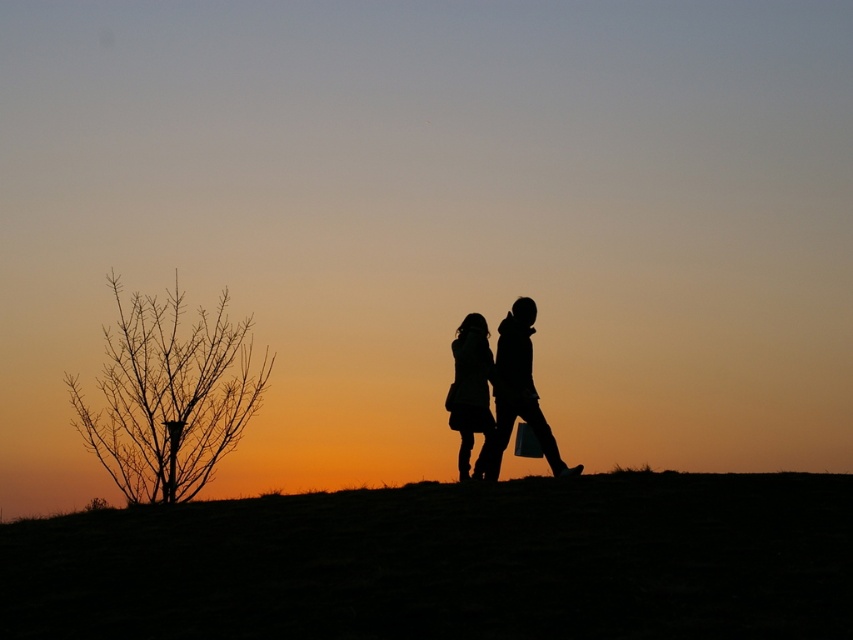
Can you confirm if dark grass at center is positioned to the right of silhouette clothing at center?

In fact, dark grass at center is to the left of silhouette clothing at center.

The height and width of the screenshot is (640, 853). Describe the element at coordinates (450, 563) in the screenshot. I see `dark grass at center` at that location.

Is point (708, 497) positioned behind point (485, 470)?

No.

At what (x,y) coordinates should I click in order to perform the action: click on dark grass at center. Please return your answer as a coordinate pair (x, y). Looking at the image, I should click on (450, 563).

Between point (821, 600) and point (473, 426), which one is positioned behind?

The point (473, 426) is more distant.

The width and height of the screenshot is (853, 640). In order to click on dark grass at center in this screenshot , I will do `click(450, 563)`.

Does point (218, 612) lie behind point (474, 346)?

No.

At what (x,y) coordinates should I click in order to perform the action: click on dark grass at center. Please return your answer as a coordinate pair (x, y). Looking at the image, I should click on (450, 563).

Does silhouette clothing at center have a greater width compared to silhouette dress at center?

Indeed, silhouette clothing at center has a greater width compared to silhouette dress at center.

Does silhouette clothing at center have a greater height compared to silhouette dress at center?

Correct, silhouette clothing at center is much taller as silhouette dress at center.

The width and height of the screenshot is (853, 640). I want to click on silhouette clothing at center, so click(515, 394).

The height and width of the screenshot is (640, 853). In order to click on silhouette clothing at center in this screenshot , I will do tap(515, 394).